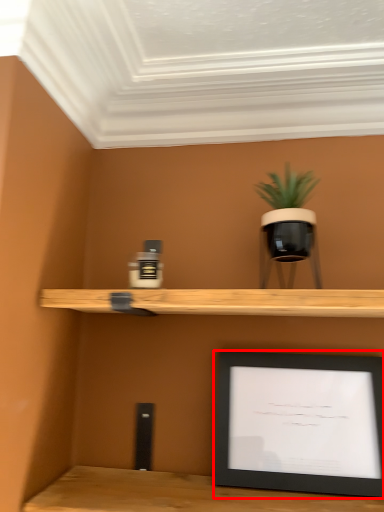
Question: From the image's perspective, what is the correct spatial relationship of picture frame (annotated by the red box) in relation to houseplant?

Choices:
 (A) below
 (B) above

Answer: (A)